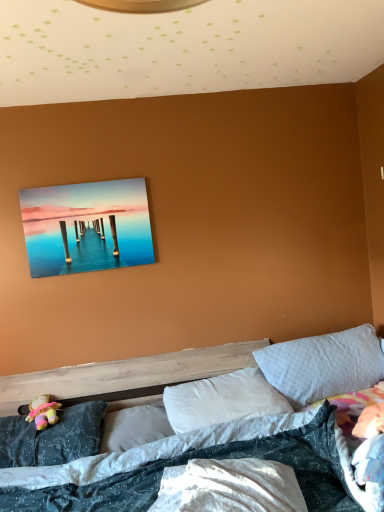
Question: From a real-world perspective, is white soft pillow at center, acting as the second pillow starting from the right, located beneath metallic glossy painting at upper center?

Choices:
 (A) no
 (B) yes

Answer: (B)

Question: Is the depth of white soft pillow at center, acting as the second pillow starting from the right, greater than that of metallic glossy painting at upper center?

Choices:
 (A) yes
 (B) no

Answer: (B)

Question: Is white soft pillow at center, arranged as the 3th pillow when viewed from the left, positioned in front of metallic glossy painting at upper center?

Choices:
 (A) no
 (B) yes

Answer: (B)

Question: Does white soft pillow at center, acting as the second pillow starting from the right, have a smaller size compared to metallic glossy painting at upper center?

Choices:
 (A) yes
 (B) no

Answer: (B)

Question: Can you confirm if white soft pillow at center, arranged as the 3th pillow when viewed from the left, is shorter than metallic glossy painting at upper center?

Choices:
 (A) no
 (B) yes

Answer: (B)

Question: In terms of size, does metallic glossy painting at upper center appear bigger or smaller than white soft pillow at center, placed as the third pillow when sorted from right to left?

Choices:
 (A) big
 (B) small

Answer: (B)

Question: Considering their positions, is metallic glossy painting at upper center located in front of or behind white soft pillow at center, placed as the third pillow when sorted from right to left?

Choices:
 (A) behind
 (B) front

Answer: (A)

Question: From their relative heights in the image, would you say metallic glossy painting at upper center is taller or shorter than white soft pillow at center, the second pillow in the left-to-right sequence?

Choices:
 (A) short
 (B) tall

Answer: (B)

Question: From the image's perspective, is metallic glossy painting at upper center positioned above or below white soft pillow at center, the second pillow in the left-to-right sequence?

Choices:
 (A) below
 (B) above

Answer: (B)

Question: Considering their positions, is white soft pillow at center, arranged as the 3th pillow when viewed from the left, located in front of or behind white soft pillow at upper right, positioned as the 1th pillow in right-to-left order?

Choices:
 (A) behind
 (B) front

Answer: (B)

Question: In the image, is white soft pillow at center, acting as the second pillow starting from the right, on the left side or the right side of white soft pillow at upper right, positioned as the 1th pillow in right-to-left order?

Choices:
 (A) left
 (B) right

Answer: (A)

Question: From the image's perspective, is white soft pillow at center, arranged as the 3th pillow when viewed from the left, located above or below white soft pillow at upper right, the 4th pillow viewed from the left?

Choices:
 (A) above
 (B) below

Answer: (B)

Question: Choose the correct answer: Is white soft pillow at center, acting as the second pillow starting from the right, inside white soft pillow at upper right, positioned as the 1th pillow in right-to-left order, or outside it?

Choices:
 (A) inside
 (B) outside

Answer: (B)

Question: Based on their sizes in the image, would you say dark blue fabric pillow at lower left, which is counted as the first pillow, starting from the left, is bigger or smaller than white soft pillow at center, acting as the second pillow starting from the right?

Choices:
 (A) big
 (B) small

Answer: (B)

Question: From the image's perspective, is dark blue fabric pillow at lower left, which is the fourth pillow in right-to-left order, above or below white soft pillow at center, acting as the second pillow starting from the right?

Choices:
 (A) above
 (B) below

Answer: (B)